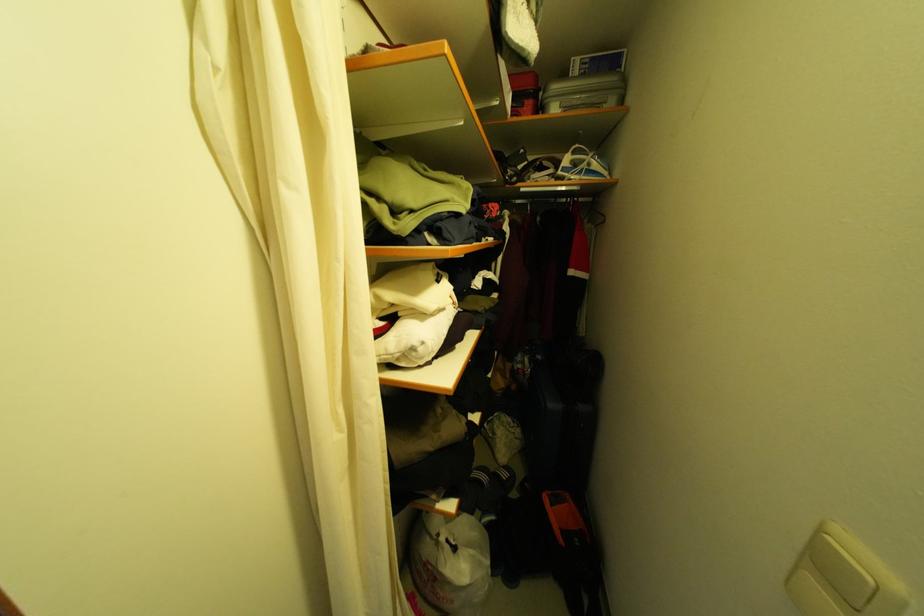
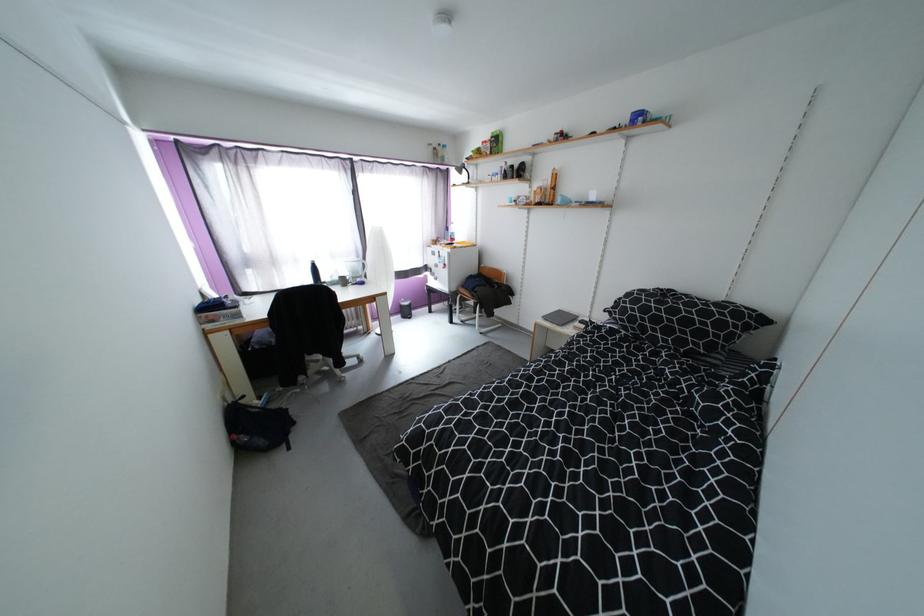
Question: How did the camera likely rotate?

Choices:
 (A) Left
 (B) Right
 (C) Up
 (D) Down

Answer: (A)